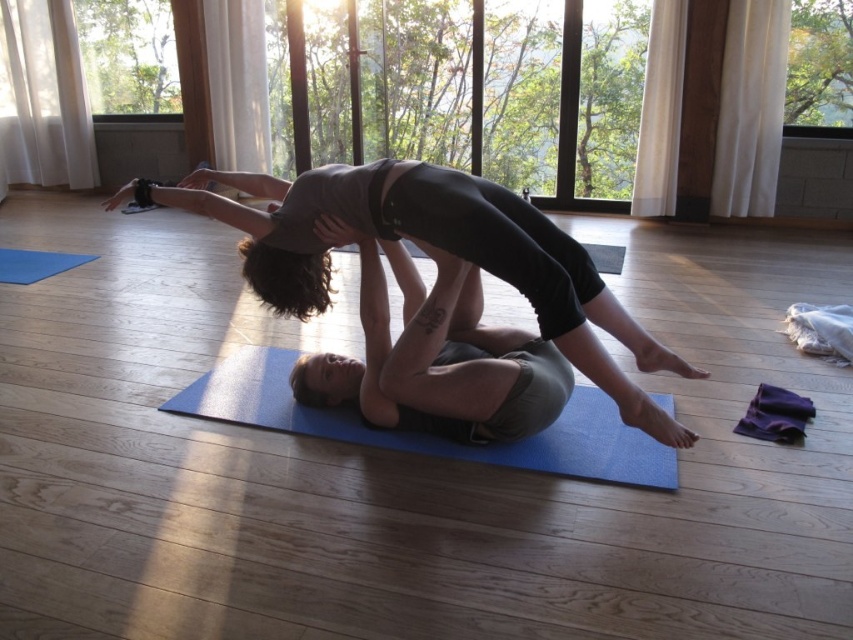
Question: Which point is farther to the camera?

Choices:
 (A) (323, 412)
 (B) (115, 205)

Answer: (B)

Question: Which point is farther from the camera taking this photo?

Choices:
 (A) (57, 268)
 (B) (218, 378)

Answer: (A)

Question: Which of the following is the farthest from the observer?

Choices:
 (A) (672, 486)
 (B) (4, 266)
 (C) (471, 321)

Answer: (B)

Question: Is black matte leggings at center wider than blue rubber yoga mat at center?

Choices:
 (A) yes
 (B) no

Answer: (A)

Question: Does black matte leggings at center appear under blue rubber yoga mat at center?

Choices:
 (A) no
 (B) yes

Answer: (A)

Question: Can you confirm if blue rubber yoga mat at center is positioned to the left of blue rubber mat at lower left?

Choices:
 (A) yes
 (B) no

Answer: (B)